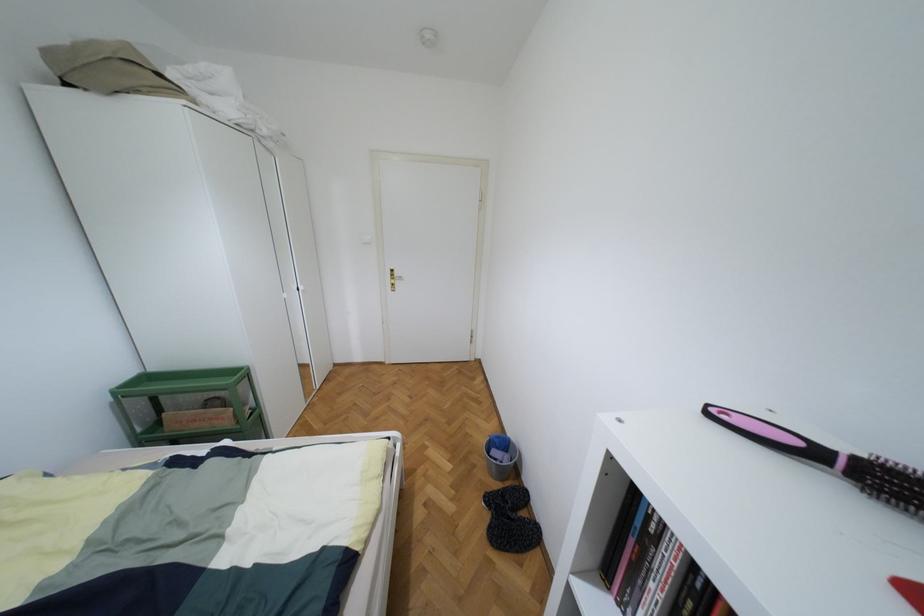
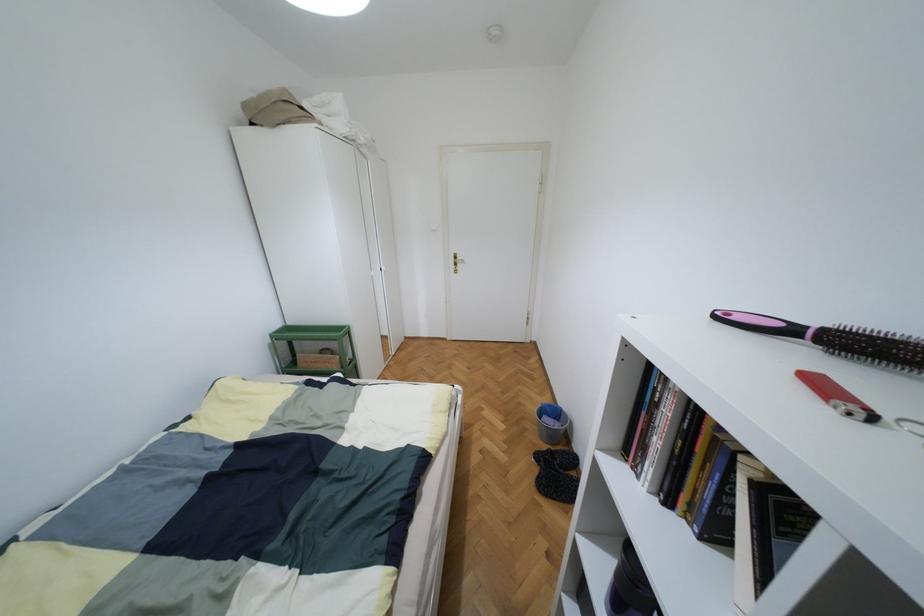
Question: In a continuous first-person perspective shot, in which direction is the camera moving?

Choices:
 (A) Left
 (B) Right
 (C) Forward
 (D) Backward

Answer: (D)